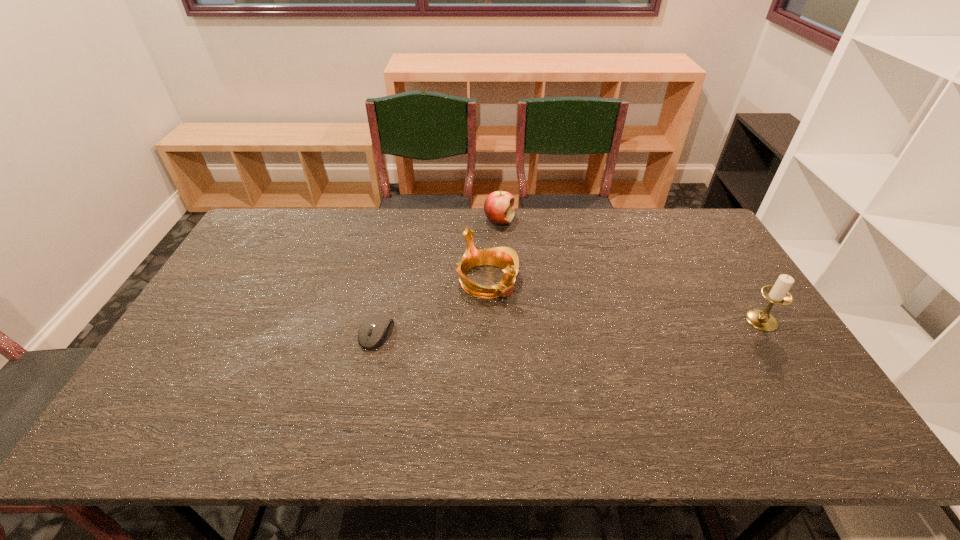
Locate an element on the screen. computer equipment is located at coordinates (381, 326).

At what (x,y) coordinates should I click in order to perform the action: click on the leftmost object. Please return your answer as a coordinate pair (x, y). Looking at the image, I should click on (381, 326).

The height and width of the screenshot is (540, 960). Find the location of `candle holder`. candle holder is located at coordinates (779, 294).

Where is `the tallest object`? the tallest object is located at coordinates (779, 294).

The width and height of the screenshot is (960, 540). In order to click on apple in this screenshot , I will do `click(499, 206)`.

Locate an element on the screen. the third nearest object is located at coordinates (506, 258).

Locate an element on the screen. This screenshot has height=540, width=960. vacant area located 0.070m on the left of the shortest object is located at coordinates (335, 334).

At what (x,y) coordinates should I click in order to perform the action: click on vacant space located 0.090m on the front of the rightmost object. Please return your answer as a coordinate pair (x, y). This screenshot has height=540, width=960. Looking at the image, I should click on (786, 359).

Identify the location of free region located 0.230m on the bitten side of the apple. point(533,270).

Identify the location of vacant space located on the bitten side of the apple. (522, 255).